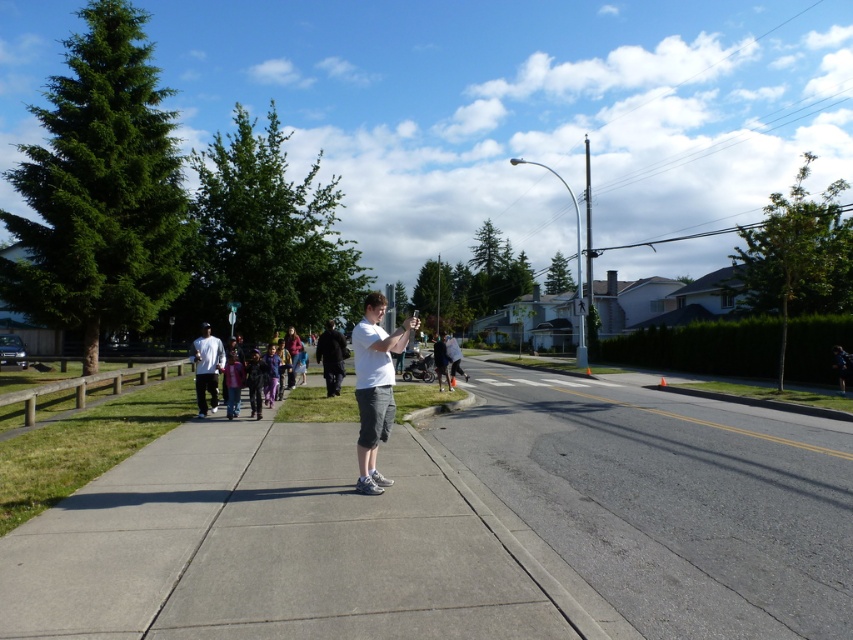
Question: Which point is closer to the camera taking this photo?

Choices:
 (A) [x=335, y=392]
 (B) [x=433, y=339]
 (C) [x=364, y=368]
 (D) [x=196, y=362]

Answer: (C)

Question: Which of these objects is positioned farthest from the gray asphalt road at center?

Choices:
 (A) dark gray pants at center
 (B) white cotton shirt at center
 (C) white matte shirt at center
 (D) light gray sweatshirt at center

Answer: (A)

Question: Which point appears farthest from the camera in this image?

Choices:
 (A) (339, 376)
 (B) (445, 348)

Answer: (B)

Question: Does gray asphalt road at center appear on the left side of white matte shirt at center?

Choices:
 (A) no
 (B) yes

Answer: (A)

Question: Does gray asphalt road at center have a larger size compared to white matte shirt at center?

Choices:
 (A) no
 (B) yes

Answer: (A)

Question: Is white matte shirt at center bigger than dark gray pants at center?

Choices:
 (A) yes
 (B) no

Answer: (B)